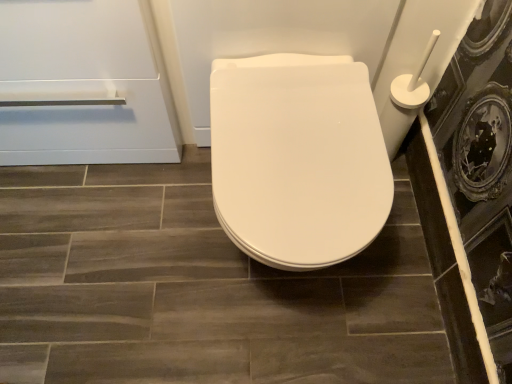
You are a GUI agent. You are given a task and a screenshot of the screen. Output one action in this format:
    pyautogui.click(x=<x>, y=<y>)
    Task: Click on the free space in front of white glossy toilet seat at center
    The height and width of the screenshot is (384, 512).
    Given the screenshot: What is the action you would take?
    pyautogui.click(x=284, y=343)